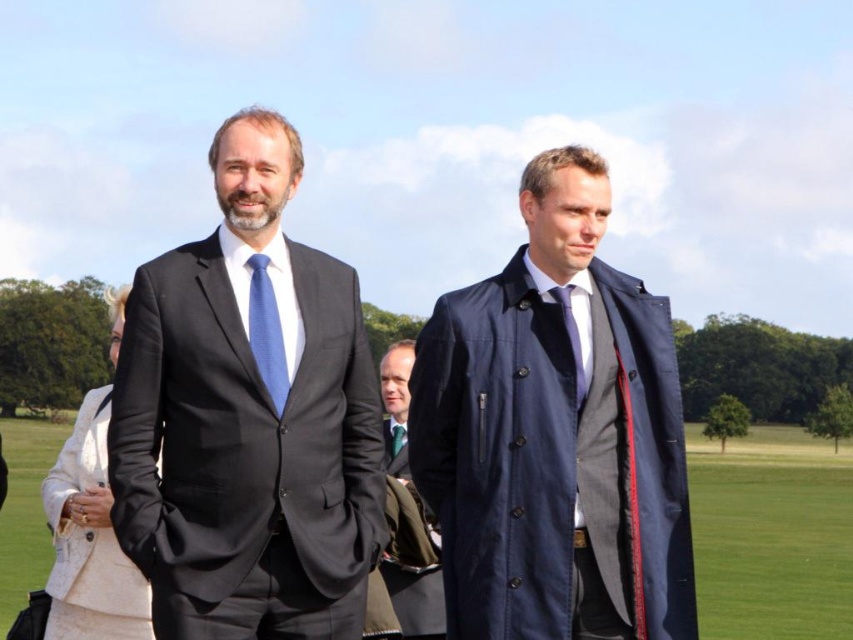
You are a photographer trying to capture a portrait of the two men in the scene. You notice the navy blue coat at center and the silky blue tie at center. Which item is positioned lower in the frame?

The navy blue coat at center is positioned lower in the frame than the silky blue tie at center.

You are a photographer setting up for a portrait session in the park. You notice two key items in the scene that are important for the shoot. The first is the navy blue coat at center, and the second is the blue silk tie at center. To ensure proper framing, you need to know their positions relative to each other. Which item is positioned to the right side of the other?

The navy blue coat at center is positioned to the right of the blue silk tie at center.